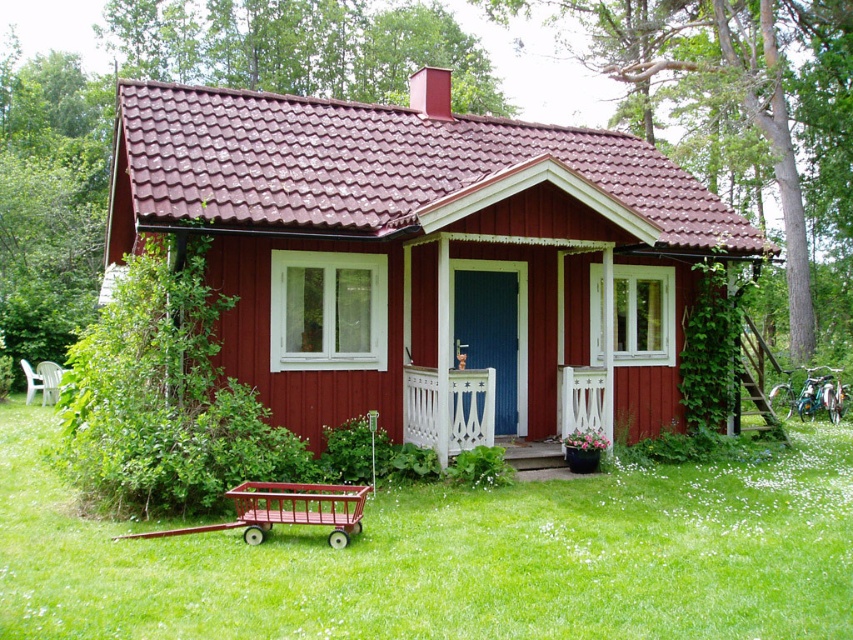
Can you confirm if green grass at lower center is smaller than white painted wood porch at center?

Incorrect, green grass at lower center is not smaller in size than white painted wood porch at center.

Does green grass at lower center lie behind white painted wood porch at center?

No, it is not.

Who is more distant from viewer, (393, 548) or (422, 385)?

The point (422, 385) is more distant.

This screenshot has width=853, height=640. What are the coordinates of `green grass at lower center` in the screenshot? It's located at (454, 556).

Consider the image. Does smooth wooden cottage at center have a larger size compared to white painted wood porch at center?

Indeed, smooth wooden cottage at center has a larger size compared to white painted wood porch at center.

Is smooth wooden cottage at center above white painted wood porch at center?

Correct, smooth wooden cottage at center is located above white painted wood porch at center.

I want to click on smooth wooden cottage at center, so click(426, 257).

Looking at this image, is the position of smooth wooden cottage at center more distant than that of green grass at lower center?

Yes, it is behind green grass at lower center.

Between point (561, 156) and point (544, 484), which one is positioned in front?

Point (544, 484) is in front.

Locate an element on the screen. smooth wooden cottage at center is located at coordinates (426, 257).